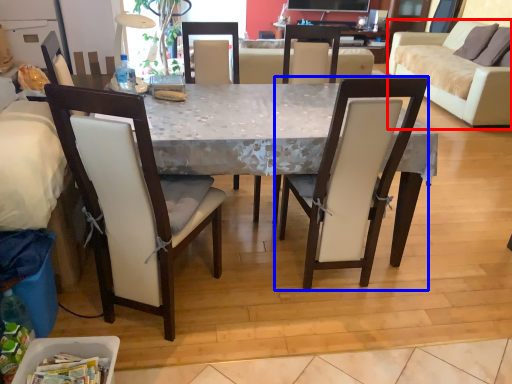
Question: Which object is further to the camera taking this photo, studio couch (highlighted by a red box) or chair (highlighted by a blue box)?

Choices:
 (A) studio couch
 (B) chair

Answer: (A)